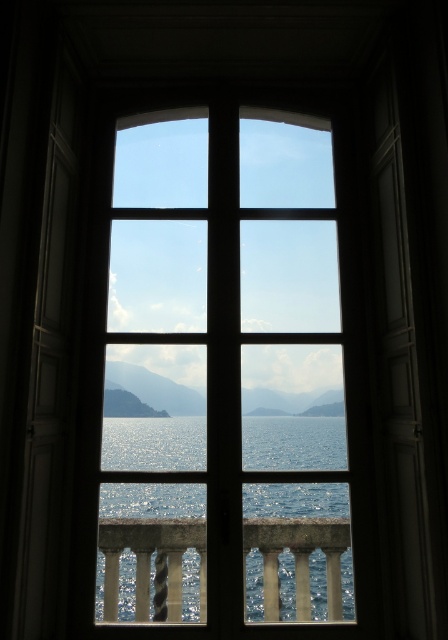
Question: Which point is closer to the camera?

Choices:
 (A) polished stone balustrade at lower center
 (B) clear glass window at center

Answer: (B)

Question: Can you confirm if clear glass window at center is positioned below polished stone balustrade at lower center?

Choices:
 (A) no
 (B) yes

Answer: (A)

Question: Is clear glass window at center to the left of polished stone balustrade at lower center from the viewer's perspective?

Choices:
 (A) no
 (B) yes

Answer: (A)

Question: Which point is farther to the camera?

Choices:
 (A) clear glass window at center
 (B) polished stone balustrade at lower center

Answer: (B)

Question: Considering the relative positions of clear glass window at center and polished stone balustrade at lower center in the image provided, where is clear glass window at center located with respect to polished stone balustrade at lower center?

Choices:
 (A) below
 (B) above

Answer: (B)